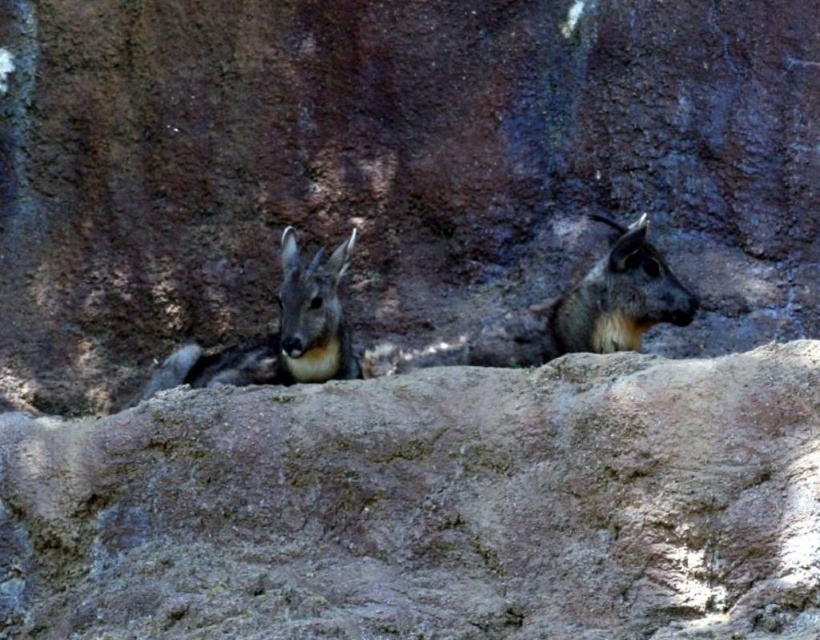
Question: Which of the following is the closest to the observer?

Choices:
 (A) (304, 308)
 (B) (682, 324)
 (C) (517, 541)

Answer: (C)

Question: Considering the relative positions of brown fur goat at center and gray fur goat at center in the image provided, where is brown fur goat at center located with respect to gray fur goat at center?

Choices:
 (A) below
 (B) above

Answer: (A)

Question: Which of these objects is positioned farthest from the brown fur goat at center?

Choices:
 (A) brown rough rock at center
 (B) gray fur goat at center

Answer: (B)

Question: Is the position of brown fur goat at center less distant than that of gray fur goat at center?

Choices:
 (A) yes
 (B) no

Answer: (A)

Question: Which point is closer to the camera?

Choices:
 (A) (338, 344)
 (B) (618, 332)
 (C) (616, 420)

Answer: (C)

Question: Is brown rough rock at center wider than brown fur goat at center?

Choices:
 (A) no
 (B) yes

Answer: (B)